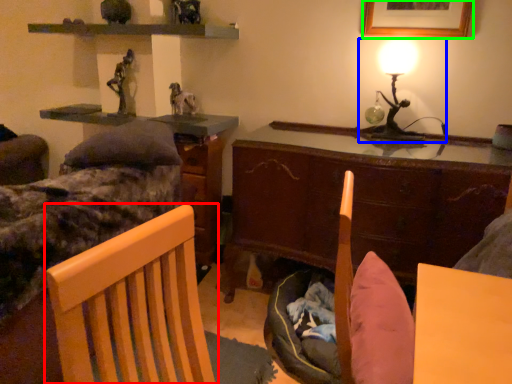
Question: Estimate the real-world distances between objects in this image. Which object is closer to chair (highlighted by a red box), table lamp (highlighted by a blue box) or picture frame (highlighted by a green box)?

Choices:
 (A) table lamp
 (B) picture frame

Answer: (A)